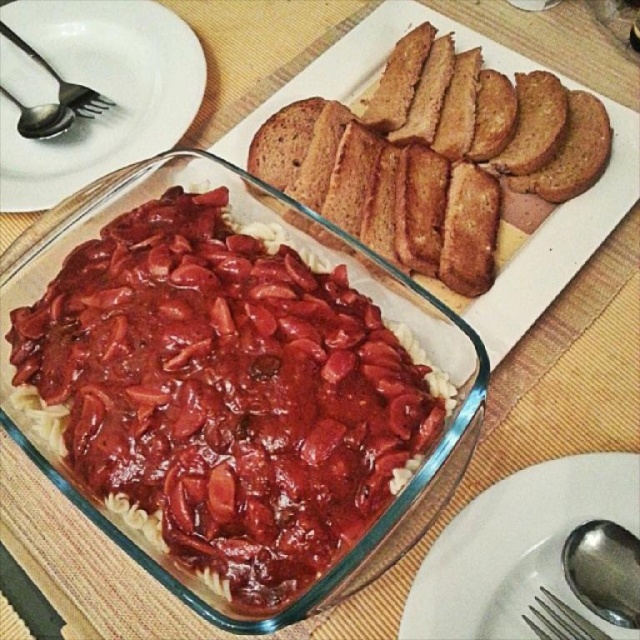
Looking at this image, which is above, white ceramic plate at upper left or brushed metal fork at upper left?

brushed metal fork at upper left

Is point (141, 38) farther from viewer compared to point (76, 108)?

Yes, point (141, 38) is farther from viewer.

Identify the location of white ceramic plate at upper left. This screenshot has height=640, width=640. [x=100, y=92].

Looking at this image, which is more to the right, brushed metal fork at upper left or silver metallic spoon at upper left?

brushed metal fork at upper left

Is brushed metal fork at upper left in front of silver metallic spoon at upper left?

No, brushed metal fork at upper left is further to the viewer.

Find the location of `brushed metal fork at upper left`. brushed metal fork at upper left is located at coordinates (65, 83).

Is shiny glass casserole at center positioned behind white ceramic plate at upper left?

That is False.

The width and height of the screenshot is (640, 640). What are the coordinates of `shiny glass casserole at center` in the screenshot? It's located at (221, 392).